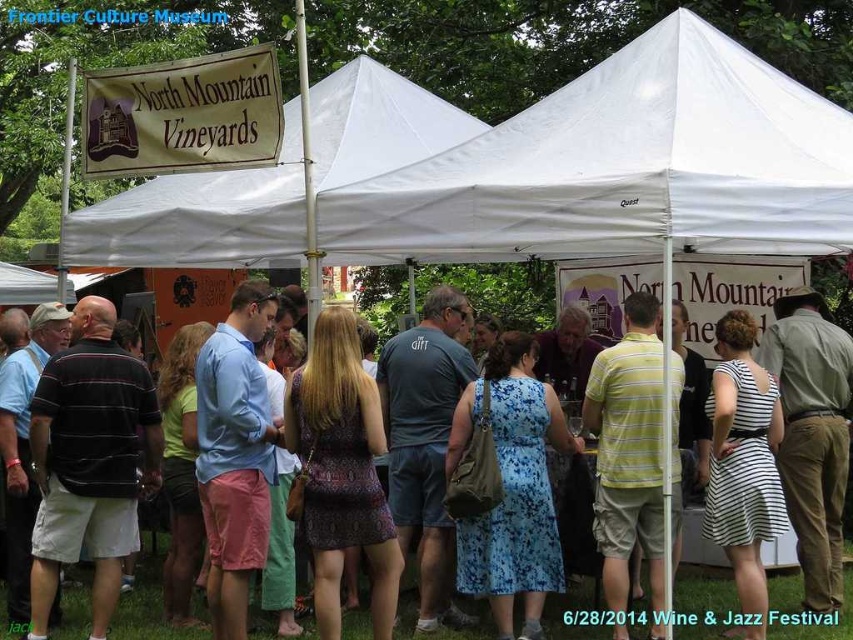
Is white fabric canopy at center taller than floral dress at center?

Indeed, white fabric canopy at center has a greater height compared to floral dress at center.

In the scene shown: Who is positioned more to the left, white fabric canopy at center or floral dress at center?

white fabric canopy at center is more to the left.

The height and width of the screenshot is (640, 853). What do you see at coordinates (622, 168) in the screenshot?
I see `white fabric canopy at center` at bounding box center [622, 168].

In order to click on white fabric canopy at center in this screenshot , I will do `click(622, 168)`.

Is white fabric canopy at upper center positioned in front of floral dress at center?

Yes, it is.

Between white fabric canopy at upper center and floral dress at center, which one has less height?

With less height is floral dress at center.

Between point (166, 257) and point (193, 628), which one is positioned in front?

Point (193, 628) is more forward.

Locate an element on the screen. The image size is (853, 640). white fabric canopy at upper center is located at coordinates pyautogui.click(x=200, y=216).

Can you confirm if white fabric canopy at center is thinner than white fabric canopy at upper center?

In fact, white fabric canopy at center might be wider than white fabric canopy at upper center.

Can you confirm if white fabric canopy at center is shorter than white fabric canopy at upper center?

Yes.

Where is `white fabric canopy at center`? white fabric canopy at center is located at coordinates (622, 168).